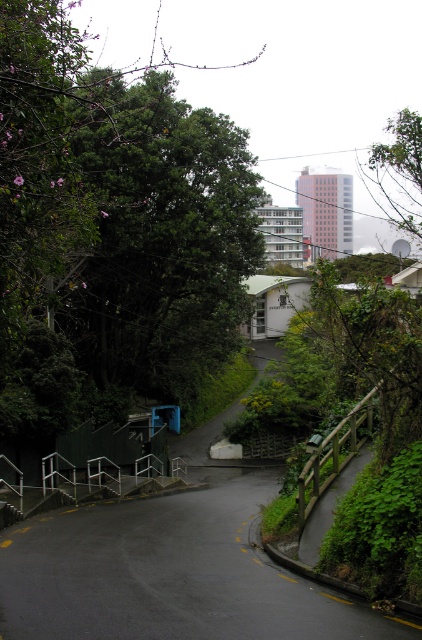
Can you confirm if green leafy tree at upper left is wider than green leafy tree at upper right?

Incorrect, green leafy tree at upper left's width does not surpass green leafy tree at upper right's.

Is green leafy tree at upper left in front of green leafy tree at upper right?

Yes, green leafy tree at upper left is in front of green leafy tree at upper right.

Is point (116, 294) closer to camera compared to point (392, 138)?

That is True.

Identify the location of green leafy tree at upper left. (161, 240).

Looking at this image, is black asphalt road at center to the right of green leafy tree at upper right from the viewer's perspective?

In fact, black asphalt road at center is to the left of green leafy tree at upper right.

Is black asphalt road at center bigger than green leafy tree at upper right?

Actually, black asphalt road at center might be smaller than green leafy tree at upper right.

Between point (118, 572) and point (421, 157), which one is positioned behind?

Point (421, 157)

At what (x,y) coordinates should I click in order to perform the action: click on black asphalt road at center. Please return your answer as a coordinate pair (x, y). The image size is (422, 640). Looking at the image, I should click on (170, 573).

Is green leafy tree at upper left thinner than black asphalt road at center?

In fact, green leafy tree at upper left might be wider than black asphalt road at center.

Is green leafy tree at upper left below black asphalt road at center?

No.

Identify the location of green leafy tree at upper left. The height and width of the screenshot is (640, 422). (161, 240).